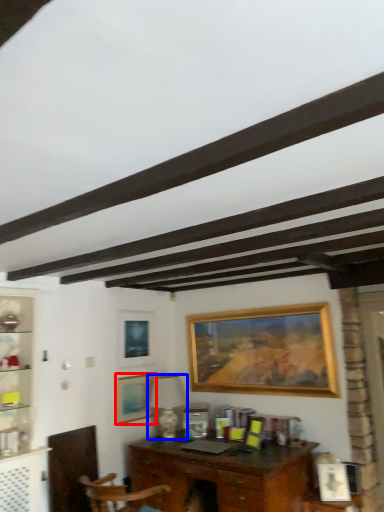
Question: Which object appears farthest to the camera in this image, picture frame (highlighted by a red box) or lamp (highlighted by a blue box)?

Choices:
 (A) picture frame
 (B) lamp

Answer: (A)